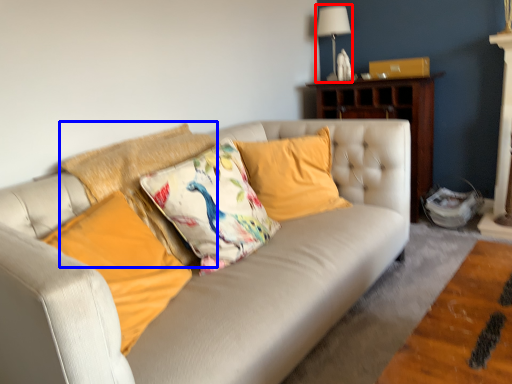
Question: Among these objects, which one is nearest to the camera, lamp (highlighted by a red box) or pillow (highlighted by a blue box)?

Choices:
 (A) lamp
 (B) pillow

Answer: (B)